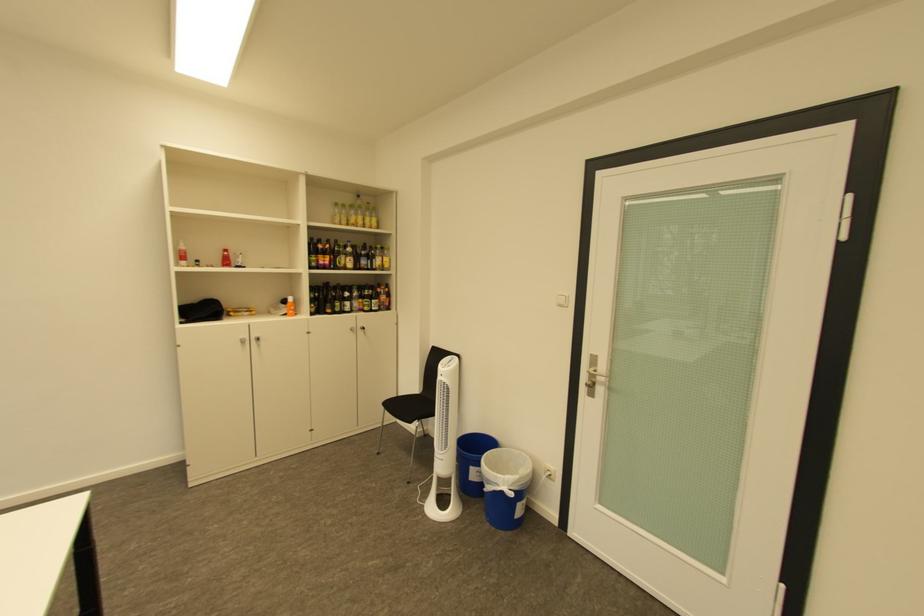
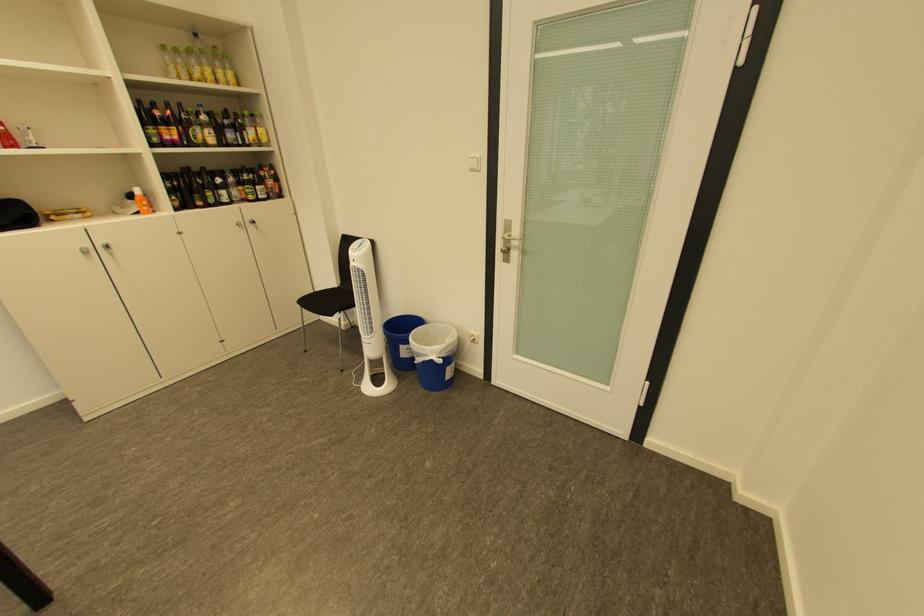
The point at [370,219] is marked in the first image. Where is the corresponding point in the second image?

(217, 71)